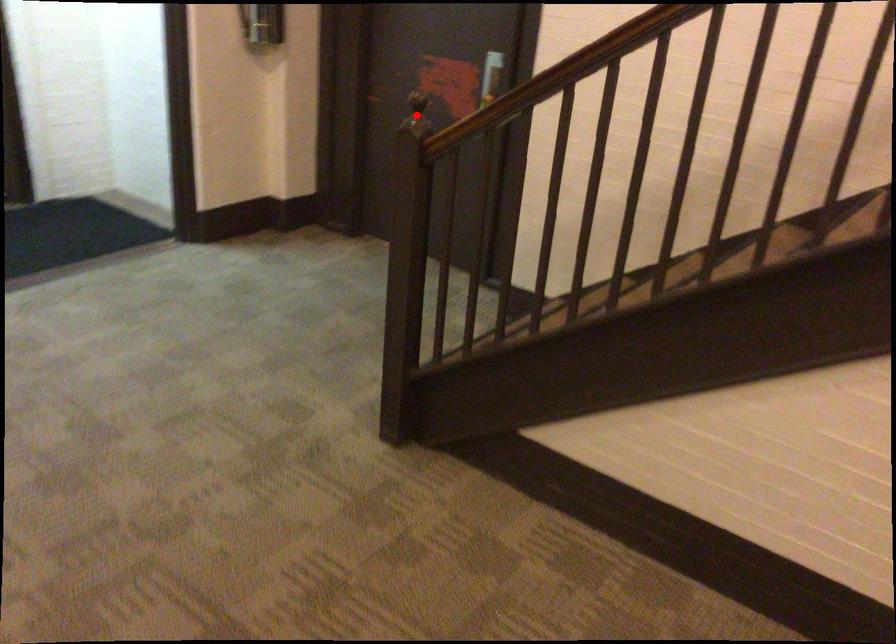
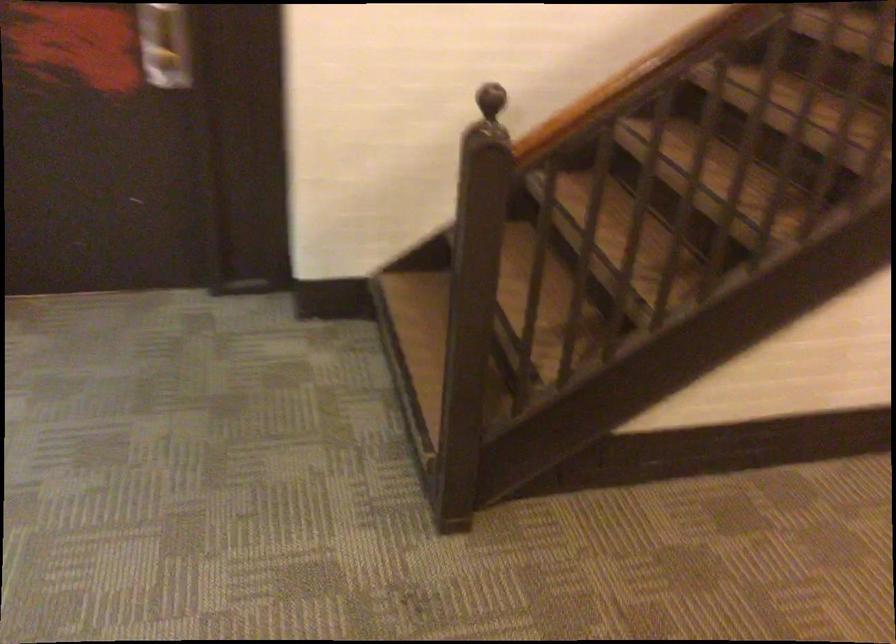
Question: I am providing you with two images of the same scene from different viewpoints. A red point is marked on the first image. At the location where the point appears in image 1, is it still visible in image 2?

Choices:
 (A) Yes
 (B) No

Answer: (B)